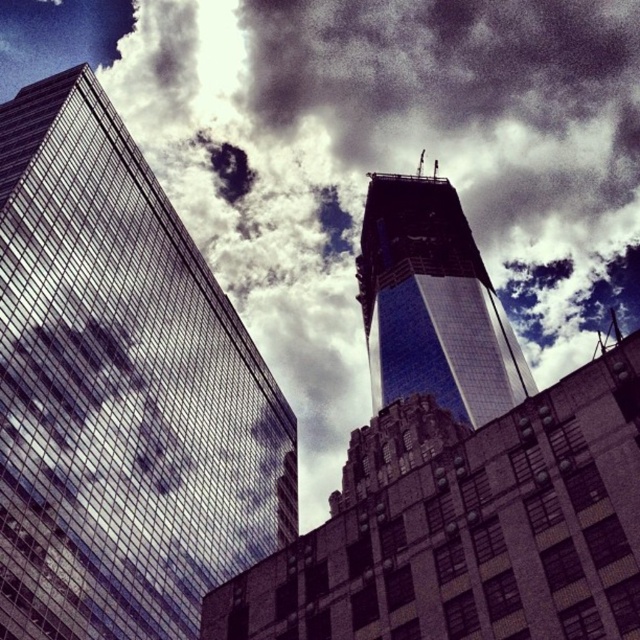
Between reflective glass skyscraper at left and blue glass skyscraper at center, which one is positioned lower?

reflective glass skyscraper at left is lower down.

Does reflective glass skyscraper at left appear over blue glass skyscraper at center?

Actually, reflective glass skyscraper at left is below blue glass skyscraper at center.

Find the location of a particular element. This screenshot has width=640, height=640. reflective glass skyscraper at left is located at coordinates (120, 390).